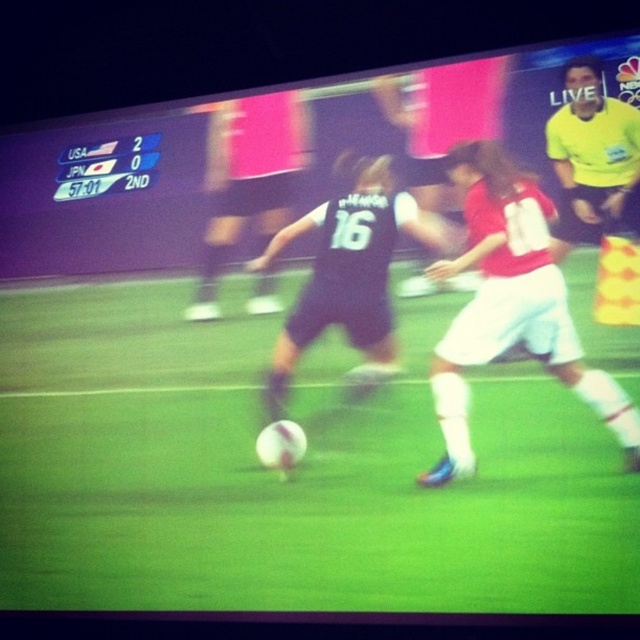
You are a soccer fan watching the live broadcast. You notice the green grass football field at center and the black matte soccer player at center. Based on their positions, which one is lower in the image?

The green grass football field at center is located below the black matte soccer player at center, so the field is lower in the image.